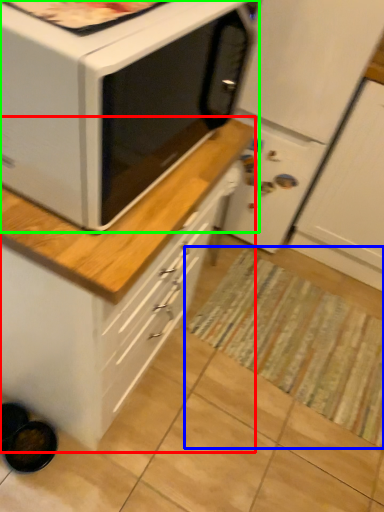
Question: Based on their relative distances, which object is nearer to cabinetry (highlighted by a red box)? Choose from mat (highlighted by a blue box) and microwave oven (highlighted by a green box).

Choices:
 (A) mat
 (B) microwave oven

Answer: (A)